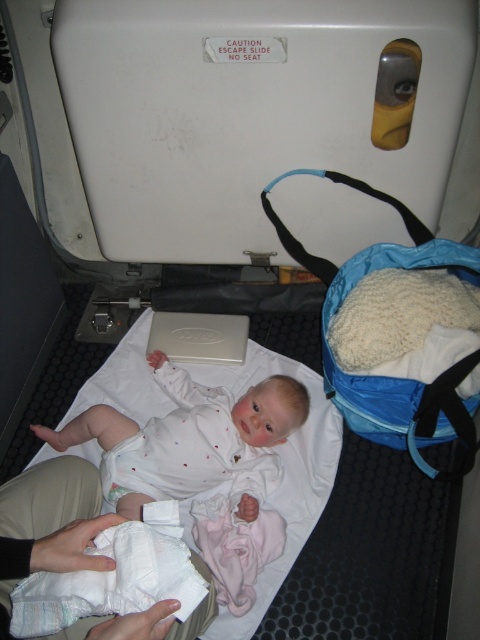
The height and width of the screenshot is (640, 480). Find the location of `white soft baby at center`. white soft baby at center is located at coordinates (183, 435).

Can you confirm if white soft baby at center is bigger than white soft diaper at lower left?

Yes.

Identify the location of white soft baby at center. This screenshot has height=640, width=480. (183, 435).